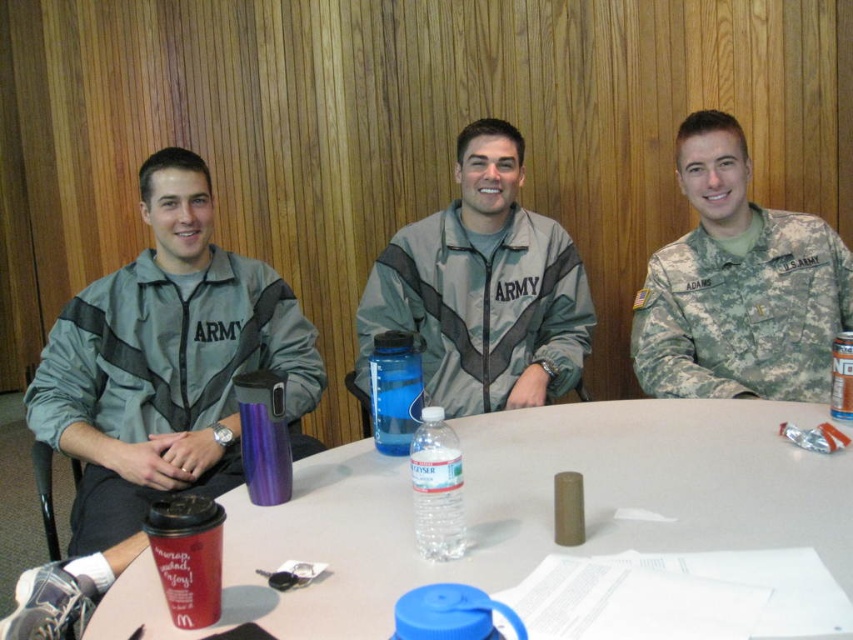
Question: Which object is farther from the camera taking this photo?

Choices:
 (A) gray matte jacket at left
 (B) white plastic table at center
 (C) clear plastic bottle at center
 (D) gray matte jacket at center

Answer: (D)

Question: Where is gray matte jacket at center located in relation to blue plastic water bottle at center in the image?

Choices:
 (A) right
 (B) left

Answer: (A)

Question: Among these objects, which one is nearest to the camera?

Choices:
 (A) gray matte jacket at left
 (B) camouflage fabric uniform at center
 (C) white plastic table at center
 (D) gray matte jacket at center

Answer: (C)

Question: Which point is closer to the camera taking this photo?

Choices:
 (A) (761, 285)
 (B) (422, 220)
 (C) (688, 544)
 (D) (131, 522)

Answer: (C)

Question: Can you confirm if gray matte jacket at left is bigger than blue plastic water bottle at center?

Choices:
 (A) yes
 (B) no

Answer: (A)

Question: Is clear plastic bottle at center smaller than blue plastic water bottle at center?

Choices:
 (A) no
 (B) yes

Answer: (B)